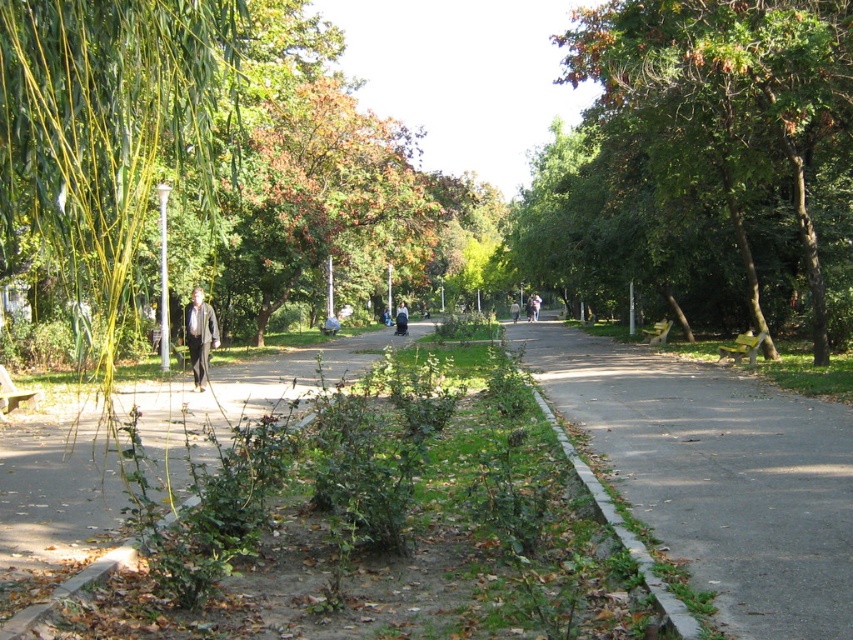
Measure the distance between brown asphalt path at center and dark gray sweater at center.

The distance of brown asphalt path at center from dark gray sweater at center is 21.41 meters.

You are a GUI agent. You are given a task and a screenshot of the screen. Output one action in this format:
    pyautogui.click(x=<x>, y=<y>)
    Task: Click on the brown asphalt path at center
    The width and height of the screenshot is (853, 640).
    Given the screenshot: What is the action you would take?
    pyautogui.click(x=252, y=387)

Locate an element on the screen. The image size is (853, 640). brown asphalt path at center is located at coordinates (252, 387).

Does point (750, 392) lie behind point (654, 160)?

No.

Locate an element on the screen. The height and width of the screenshot is (640, 853). gray asphalt pavement at center is located at coordinates (717, 474).

Identify the location of gray asphalt pavement at center. (717, 474).

Is light brown leather jacket at center further to camera compared to dark gray sweater at center?

No, it is not.

Which is more to the left, light brown leather jacket at center or dark gray sweater at center?

Positioned to the left is dark gray sweater at center.

Who is more forward, (207, 339) or (405, 316)?

Positioned in front is point (207, 339).

Identify the location of light brown leather jacket at center. (200, 337).